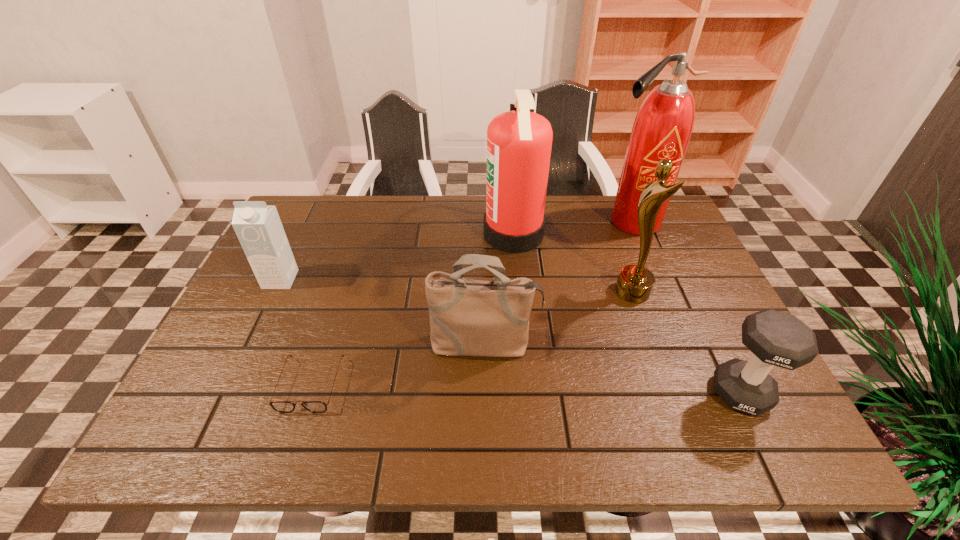
Where is `free space at the near left corner of the desktop`? The height and width of the screenshot is (540, 960). free space at the near left corner of the desktop is located at coordinates (174, 437).

Where is `vacant area that lies between the second object from left to right and the shoulder bag`? vacant area that lies between the second object from left to right and the shoulder bag is located at coordinates (397, 364).

The height and width of the screenshot is (540, 960). I want to click on free point between the right fire extinguisher and the shoulder bag, so click(x=558, y=283).

The height and width of the screenshot is (540, 960). Identify the location of unoccupied area between the right fire extinguisher and the shoulder bag. (558, 283).

Locate an element on the screen. The width and height of the screenshot is (960, 540). free space that is in between the dumbbell and the shoulder bag is located at coordinates (612, 369).

This screenshot has width=960, height=540. Identify the location of free space between the left fire extinguisher and the sixth tallest object. (627, 314).

This screenshot has width=960, height=540. What are the coordinates of `vacant region between the dumbbell and the right fire extinguisher` in the screenshot? It's located at 686,307.

Where is `unoccupied area between the right fire extinguisher and the dumbbell`? unoccupied area between the right fire extinguisher and the dumbbell is located at coordinates (686, 307).

Identify the location of unoccupied area between the award and the shoulder bag. This screenshot has width=960, height=540. (559, 318).

Where is `object that is the fourth nearest to the award`? Image resolution: width=960 pixels, height=540 pixels. object that is the fourth nearest to the award is located at coordinates (468, 317).